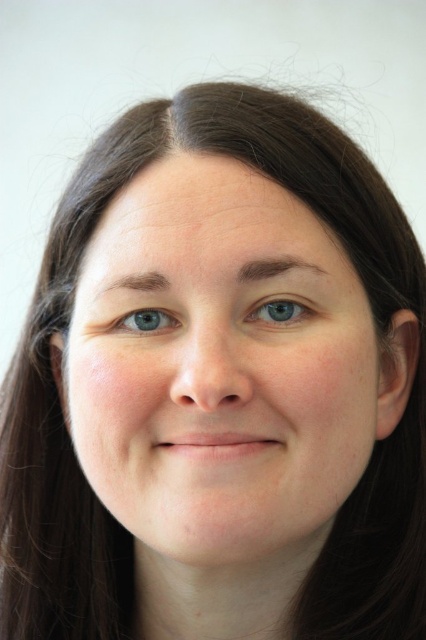
Question: Is blue matte eye at center to the left of blue smooth eye at center from the viewer's perspective?

Choices:
 (A) yes
 (B) no

Answer: (B)

Question: Can you confirm if blue matte eye at center is positioned below blue smooth eye at center?

Choices:
 (A) yes
 (B) no

Answer: (B)

Question: Can you confirm if blue matte eye at center is thinner than blue smooth eye at center?

Choices:
 (A) no
 (B) yes

Answer: (A)